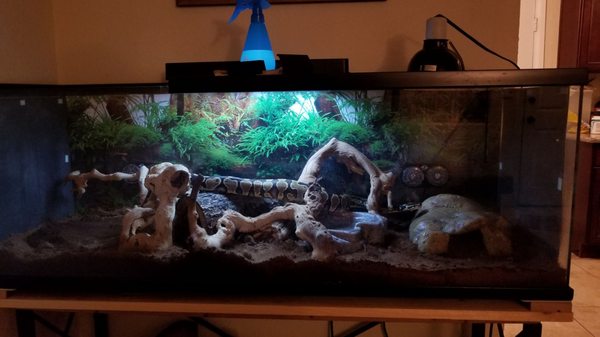
Locate an element on the screen. The height and width of the screenshot is (337, 600). side wall is located at coordinates (28, 157).